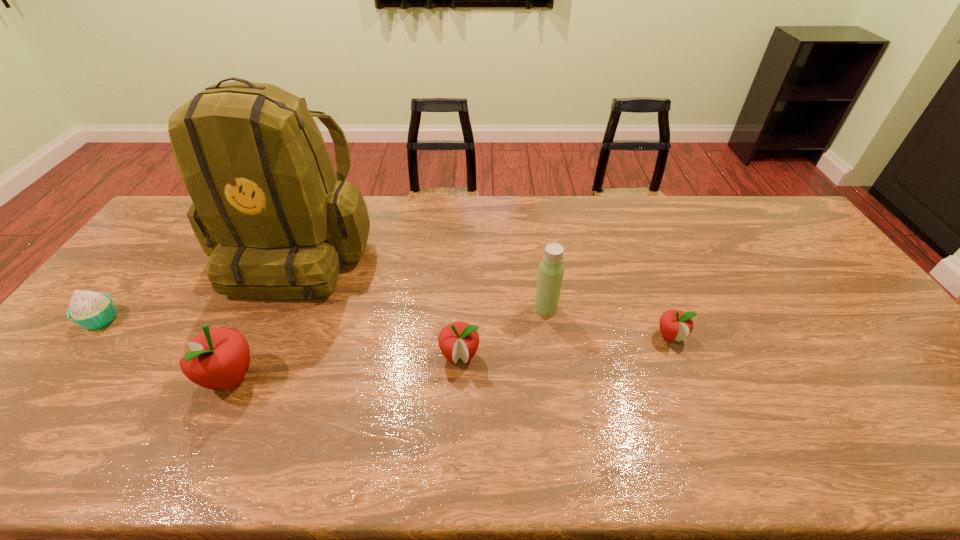
Locate an element on the screen. The height and width of the screenshot is (540, 960). vacant area between the tallest object and the second apple from right to left is located at coordinates (378, 303).

At what (x,y) coordinates should I click in order to perform the action: click on free area in between the leftmost object and the tallest object. Please return your answer as a coordinate pair (x, y). Looking at the image, I should click on (199, 285).

At what (x,y) coordinates should I click in order to perform the action: click on free spot between the rightmost object and the cupcake. Please return your answer as a coordinate pair (x, y). Looking at the image, I should click on (385, 327).

Where is `object that stands as the fifth closest to the leftmost apple`? object that stands as the fifth closest to the leftmost apple is located at coordinates [674, 324].

Image resolution: width=960 pixels, height=540 pixels. I want to click on object that stands as the fifth closest to the leftmost apple, so click(674, 324).

Where is `apple that stands as the second closest to the third object from right to left`? The image size is (960, 540). apple that stands as the second closest to the third object from right to left is located at coordinates (674, 324).

Locate which apple ranks in proximity to the backpack. Please provide its 2D coordinates. Your answer should be formatted as a tuple, i.e. [(x, y)], where the tuple contains the x and y coordinates of a point satisfying the conditions above.

[(220, 357)]

Where is `vacant region that satisfies the following two spatial constraints: 1. on the front-facing side of the fifth object from left to right; 2. on the left side of the tallest object`? The height and width of the screenshot is (540, 960). vacant region that satisfies the following two spatial constraints: 1. on the front-facing side of the fifth object from left to right; 2. on the left side of the tallest object is located at coordinates (272, 308).

I want to click on vacant region that satisfies the following two spatial constraints: 1. on the back side of the thermos bottle; 2. on the right side of the second shortest apple, so click(x=462, y=308).